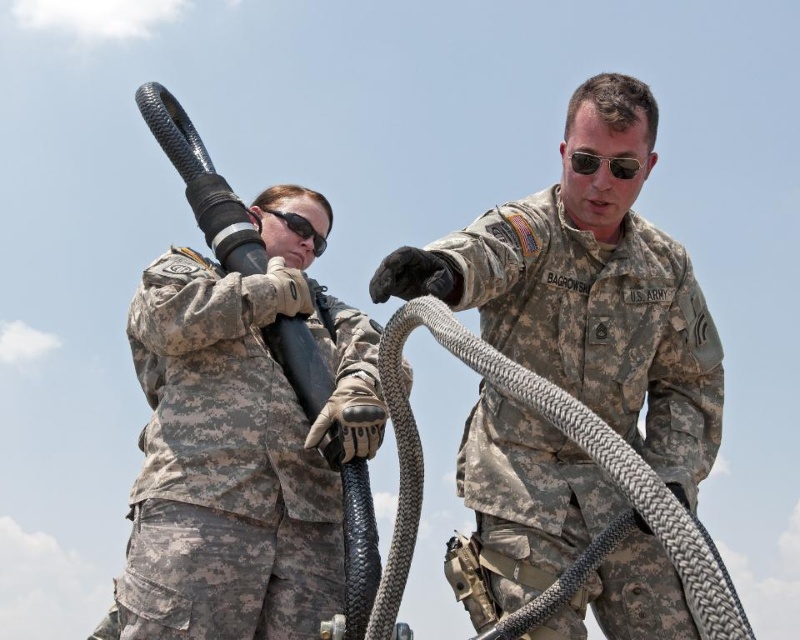
You are a military recruit observing the scene and need to report the relative sizes of the objects. Which object is taller between the camouflage fabric uniform at center and the sunglasses at center?

The camouflage fabric uniform at center is taller than the sunglasses at center.

You are a military trainee observing the scene. You need to locate a specific point marked at coordinates point (240, 444). According to the scene description, where exactly is this point located?

The point (240, 444) is on the camouflage fabric uniform at center.

You are a military trainee who needs to move from the camouflage fabric us army uniform at center to the camouflage fabric uniform at center. The training area has a restricted zone that starts 10 meters away from your starting point. Will you enter the restricted zone during your path?

The distance between the camouflage fabric us army uniform at center and the camouflage fabric uniform at center is 14.49 meters. Since the restricted zone starts at 10 meters from the starting point, moving to the camouflage fabric uniform at center requires going beyond the 10 meter mark, meaning you will enter the restricted zone during your path.